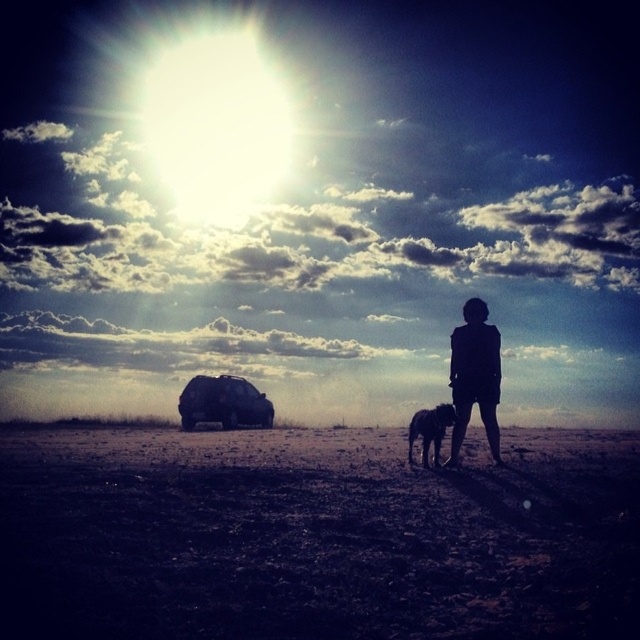
Question: Does silhouette figure at center have a lesser width compared to shiny black dog at center?

Choices:
 (A) no
 (B) yes

Answer: (A)

Question: Which is nearer to the silhouette figure at center?

Choices:
 (A) satin black suv at lower center
 (B) shiny black dog at center

Answer: (B)

Question: Which object is the farthest from the satin black suv at lower center?

Choices:
 (A) silhouette figure at center
 (B) shiny black dog at center
 (C) dark brown dirt field at center

Answer: (A)

Question: Does silhouette figure at center have a greater width compared to satin black suv at lower center?

Choices:
 (A) yes
 (B) no

Answer: (B)

Question: Which object is positioned farthest from the shiny black dog at center?

Choices:
 (A) satin black suv at lower center
 (B) silhouette figure at center

Answer: (A)

Question: Can you confirm if silhouette figure at center is positioned to the left of shiny black dog at center?

Choices:
 (A) no
 (B) yes

Answer: (A)